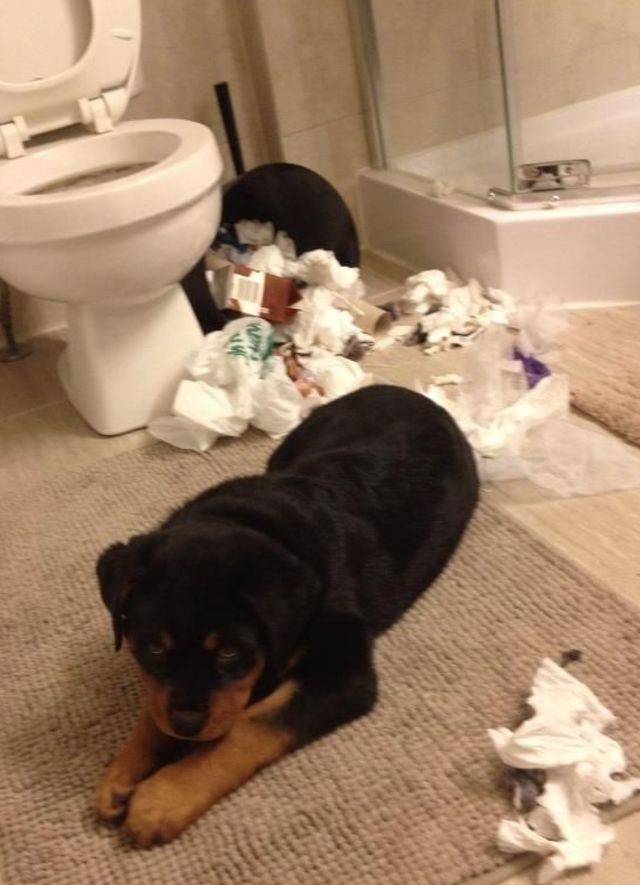
You are a GUI agent. You are given a task and a screenshot of the screen. Output one action in this format:
    pyautogui.click(x=<x>, y=<y>)
    Task: Click on the floor
    This screenshot has width=640, height=885.
    Given the screenshot: What is the action you would take?
    pyautogui.click(x=604, y=496)